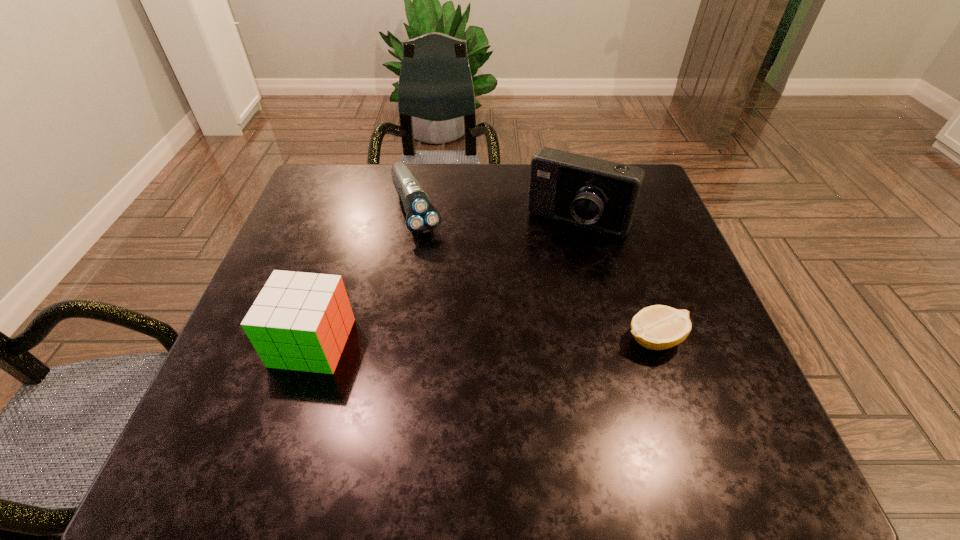
What are the coordinates of `vacant space on the desktop that is between the cube and the shortest object and is positioned on the head of the electric shaver` in the screenshot? It's located at (480, 341).

Identify the location of free space on the desktop that is between the cube and the lemon and is positioned on the front-facing side of the camera. (506, 340).